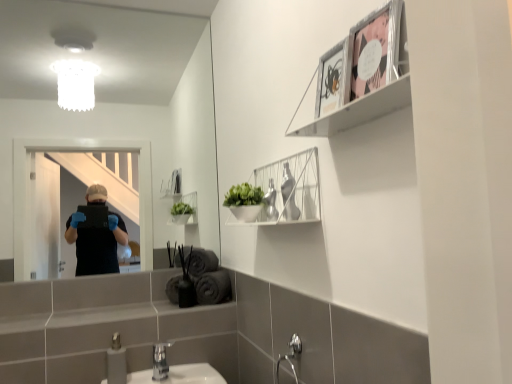
What is the approximate width of metallic silver picture frame at upper right, arranged as the first picture frame when viewed from the left?

metallic silver picture frame at upper right, arranged as the first picture frame when viewed from the left, is 1.29 inches in width.

Describe the element at coordinates (160, 361) in the screenshot. I see `silver metallic faucet at lower center` at that location.

Describe the element at coordinates (116, 362) in the screenshot. I see `brushed metal faucet at lower center` at that location.

Identify the location of metallic silver frame at upper right, the 2th cabinet ordered from the bottom. This screenshot has height=384, width=512. (361, 75).

The height and width of the screenshot is (384, 512). In order to click on white wire mesh shelf at upper center, the 1th cabinet positioned from the back in this screenshot , I will do `click(288, 190)`.

This screenshot has height=384, width=512. What do you see at coordinates (114, 98) in the screenshot?
I see `clear glass mirror at upper center` at bounding box center [114, 98].

The width and height of the screenshot is (512, 384). Find the location of `metallic silver picture frame at upper right, arranged as the first picture frame when viewed from the left`. metallic silver picture frame at upper right, arranged as the first picture frame when viewed from the left is located at coordinates pos(334,78).

Is brushed metal faucet at lower center next to metallic silver frame at upper right, acting as the first cabinet starting from the front, and touching it?

No, brushed metal faucet at lower center is not next to metallic silver frame at upper right, acting as the first cabinet starting from the front.

Between brushed metal faucet at lower center and metallic silver frame at upper right, which is counted as the first cabinet, starting from the top, which one has larger size?

Bigger between the two is metallic silver frame at upper right, which is counted as the first cabinet, starting from the top.

Does brushed metal faucet at lower center turn towards metallic silver frame at upper right, which is counted as the first cabinet, starting from the top?

No, brushed metal faucet at lower center does not turn towards metallic silver frame at upper right, which is counted as the first cabinet, starting from the top.

How different are the orientations of clear glass mirror at upper center and silver metallic faucet at lower center in degrees?

They differ by 0.000286 degrees in their facing directions.

Looking at this image, can you confirm if clear glass mirror at upper center is positioned to the left of silver metallic faucet at lower center?

Correct, you'll find clear glass mirror at upper center to the left of silver metallic faucet at lower center.

In the scene shown: From the image's perspective, which is below, clear glass mirror at upper center or silver metallic faucet at lower center?

silver metallic faucet at lower center is shown below in the image.

Considering the sizes of clear glass mirror at upper center and silver metallic faucet at lower center in the image, is clear glass mirror at upper center taller or shorter than silver metallic faucet at lower center?

In the image, clear glass mirror at upper center appears to be taller than silver metallic faucet at lower center.

How many degrees apart are the facing directions of white wire mesh shelf at upper center, the 2th cabinet from the top, and clear glass mirror at upper center?

The angle between the facing direction of white wire mesh shelf at upper center, the 2th cabinet from the top, and the facing direction of clear glass mirror at upper center is 89.1 degrees.

The width and height of the screenshot is (512, 384). Find the location of `cabinet below the clear glass mirror at upper center (from the image's perspective)`. cabinet below the clear glass mirror at upper center (from the image's perspective) is located at coordinates (288, 190).

In the scene shown: Between white wire mesh shelf at upper center, positioned as the 2th cabinet in front-to-back order, and clear glass mirror at upper center, which one is positioned behind?

clear glass mirror at upper center.

Which object is positioned more to the right, white wire mesh shelf at upper center, the first cabinet in the bottom-to-top sequence, or clear glass mirror at upper center?

white wire mesh shelf at upper center, the first cabinet in the bottom-to-top sequence, is more to the right.

Who is taller, white wire mesh shelf at upper center, the 2th cabinet from the top, or pink paper picture frame at upper right, acting as the 1th picture frame starting from the right?

white wire mesh shelf at upper center, the 2th cabinet from the top.

From the image's perspective, is white wire mesh shelf at upper center, the first cabinet in the bottom-to-top sequence, on pink paper picture frame at upper right, acting as the 1th picture frame starting from the right?

Incorrect, from the image's perspective, white wire mesh shelf at upper center, the first cabinet in the bottom-to-top sequence, is lower than pink paper picture frame at upper right, acting as the 1th picture frame starting from the right.

Considering the relative positions of white wire mesh shelf at upper center, positioned as the 2th cabinet in front-to-back order, and pink paper picture frame at upper right, acting as the 1th picture frame starting from the right, in the image provided, is white wire mesh shelf at upper center, positioned as the 2th cabinet in front-to-back order, to the left of pink paper picture frame at upper right, acting as the 1th picture frame starting from the right, from the viewer's perspective?

Indeed, white wire mesh shelf at upper center, positioned as the 2th cabinet in front-to-back order, is positioned on the left side of pink paper picture frame at upper right, acting as the 1th picture frame starting from the right.

Which is in front, white wire mesh shelf at upper center, positioned as the 2th cabinet in front-to-back order, or pink paper picture frame at upper right, acting as the 1th picture frame starting from the right?

pink paper picture frame at upper right, acting as the 1th picture frame starting from the right, is closer to the camera.

Is metallic silver picture frame at upper right, arranged as the first picture frame when viewed from the left, completely or partially inside metallic silver frame at upper right, which is counted as the first cabinet, starting from the top?

Yes, metallic silver picture frame at upper right, arranged as the first picture frame when viewed from the left, is a part of metallic silver frame at upper right, which is counted as the first cabinet, starting from the top.

From the picture: From their relative heights in the image, would you say metallic silver frame at upper right, which is counted as the first cabinet, starting from the top, is taller or shorter than metallic silver picture frame at upper right, arranged as the first picture frame when viewed from the left?

In the image, metallic silver frame at upper right, which is counted as the first cabinet, starting from the top, appears to be taller than metallic silver picture frame at upper right, arranged as the first picture frame when viewed from the left.

From the image's perspective, which is above, metallic silver frame at upper right, the 2th cabinet in the back-to-front sequence, or metallic silver picture frame at upper right, arranged as the first picture frame when viewed from the left?

metallic silver frame at upper right, the 2th cabinet in the back-to-front sequence, appears higher in the image.

Image resolution: width=512 pixels, height=384 pixels. I want to click on the 2nd picture frame behind the metallic silver frame at upper right, the 2th cabinet in the back-to-front sequence, starting your count from the anchor, so click(334, 78).

Considering the sizes of metallic silver picture frame at upper right, arranged as the first picture frame when viewed from the left, and brushed metal faucet at lower center in the image, is metallic silver picture frame at upper right, arranged as the first picture frame when viewed from the left, taller or shorter than brushed metal faucet at lower center?

metallic silver picture frame at upper right, arranged as the first picture frame when viewed from the left, is shorter than brushed metal faucet at lower center.

Is brushed metal faucet at lower center a part of metallic silver picture frame at upper right, arranged as the first picture frame when viewed from the left?

Definitely not — brushed metal faucet at lower center is not inside metallic silver picture frame at upper right, arranged as the first picture frame when viewed from the left.

Does metallic silver picture frame at upper right, the 2th picture frame when ordered from right to left, have a smaller size compared to brushed metal faucet at lower center?

Yes, metallic silver picture frame at upper right, the 2th picture frame when ordered from right to left, is smaller than brushed metal faucet at lower center.

Identify the location of toiletry behind the metallic silver picture frame at upper right, arranged as the first picture frame when viewed from the left. This screenshot has width=512, height=384. (116, 362).

Is clear glass mirror at upper center oriented towards brushed metal faucet at lower center?

No, clear glass mirror at upper center is not oriented towards brushed metal faucet at lower center.

From the image's perspective, relative to brushed metal faucet at lower center, is clear glass mirror at upper center above or below?

clear glass mirror at upper center is situated higher than brushed metal faucet at lower center in the image.

Which is nearer, (x=85, y=131) or (x=110, y=350)?

The point (x=110, y=350) is closer to the camera.

Can you confirm if clear glass mirror at upper center is taller than brushed metal faucet at lower center?

Yes.

From the image's perspective, count 2nd cabinets upward from the brushed metal faucet at lower center and point to it. Please provide its 2D coordinates.

[(361, 75)]

In the image, there is a clear glass mirror at upper center. Where is `tap below it (from a real-world perspective)`? tap below it (from a real-world perspective) is located at coordinates (160, 361).

Considering their positions, is brushed metal faucet at lower center positioned further to clear glass mirror at upper center than pink paper picture frame at upper right, acting as the 1th picture frame starting from the right?

The object further to clear glass mirror at upper center is pink paper picture frame at upper right, acting as the 1th picture frame starting from the right.

When comparing their distances from brushed metal faucet at lower center, does pink paper picture frame at upper right, acting as the 1th picture frame starting from the right, or metallic silver frame at upper right, the 2th cabinet in the back-to-front sequence, seem closer?

Based on the image, metallic silver frame at upper right, the 2th cabinet in the back-to-front sequence, appears to be nearer to brushed metal faucet at lower center.

Looking at the image, which one is located further to metallic silver picture frame at upper right, the 2th picture frame when ordered from right to left, clear glass mirror at upper center or metallic silver frame at upper right, acting as the first cabinet starting from the front?

clear glass mirror at upper center is further to metallic silver picture frame at upper right, the 2th picture frame when ordered from right to left.

When comparing their distances from pink paper picture frame at upper right, acting as the 1th picture frame starting from the right, does brushed metal faucet at lower center or metallic silver picture frame at upper right, arranged as the first picture frame when viewed from the left, seem closer?

Among the two, metallic silver picture frame at upper right, arranged as the first picture frame when viewed from the left, is located nearer to pink paper picture frame at upper right, acting as the 1th picture frame starting from the right.

Considering their positions, is metallic silver picture frame at upper right, arranged as the first picture frame when viewed from the left, positioned closer to clear glass mirror at upper center than brushed metal faucet at lower center?

brushed metal faucet at lower center is closer to clear glass mirror at upper center.

Looking at the image, which one is located further to pink paper picture frame at upper right, acting as the 1th picture frame starting from the right, metallic silver picture frame at upper right, the 2th picture frame when ordered from right to left, or metallic silver frame at upper right, the 2th cabinet ordered from the bottom?

Based on the image, metallic silver picture frame at upper right, the 2th picture frame when ordered from right to left, appears to be further to pink paper picture frame at upper right, acting as the 1th picture frame starting from the right.

Which object lies nearer to the anchor point metallic silver picture frame at upper right, arranged as the first picture frame when viewed from the left, metallic silver frame at upper right, acting as the first cabinet starting from the front, or white wire mesh shelf at upper center, the 1th cabinet positioned from the back?

Based on the image, metallic silver frame at upper right, acting as the first cabinet starting from the front, appears to be nearer to metallic silver picture frame at upper right, arranged as the first picture frame when viewed from the left.

From the image, which object appears to be nearer to silver metallic faucet at lower center, white wire mesh shelf at upper center, the 2th cabinet from the top, or metallic silver frame at upper right, the 2th cabinet in the back-to-front sequence?

Based on the image, white wire mesh shelf at upper center, the 2th cabinet from the top, appears to be nearer to silver metallic faucet at lower center.

The width and height of the screenshot is (512, 384). I want to click on cabinet between metallic silver picture frame at upper right, arranged as the first picture frame when viewed from the left, and silver metallic faucet at lower center in the up-down direction, so click(288, 190).

This screenshot has width=512, height=384. In order to click on toiletry that lies between clear glass mirror at upper center and silver metallic faucet at lower center from top to bottom in this screenshot , I will do `click(116, 362)`.

Locate an element on the screen. tap positioned between metallic silver frame at upper right, the 2th cabinet in the back-to-front sequence, and clear glass mirror at upper center from near to far is located at coordinates (160, 361).

Where is `picture frame between clear glass mirror at upper center and brushed metal faucet at lower center in the vertical direction`? picture frame between clear glass mirror at upper center and brushed metal faucet at lower center in the vertical direction is located at coordinates (334, 78).